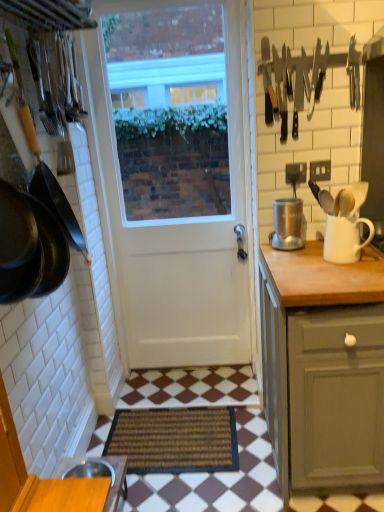
This screenshot has height=512, width=384. I want to click on vacant space in front of silver metallic coffee grinder at right, so click(x=303, y=257).